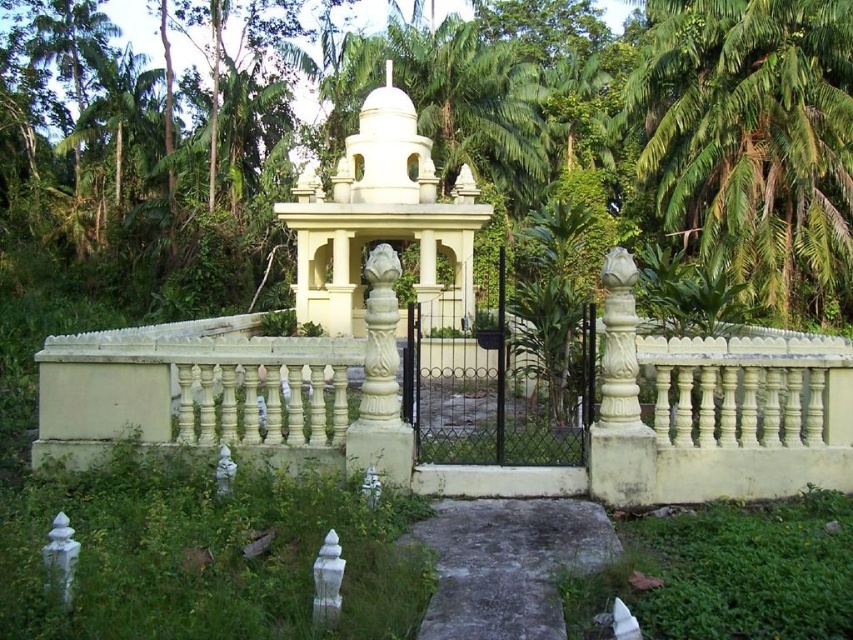
Does green leafy palm tree at upper right have a greater height compared to white stone gazebo at center?

Indeed, green leafy palm tree at upper right has a greater height compared to white stone gazebo at center.

Who is shorter, green leafy palm tree at upper right or white stone gazebo at center?

With less height is white stone gazebo at center.

Find the location of a particular element. This screenshot has height=640, width=853. green leafy palm tree at upper right is located at coordinates (751, 134).

Between white stone fence at center and white stone gazebo at center, which one appears on the right side from the viewer's perspective?

white stone gazebo at center is more to the right.

Is white stone fence at center further to the viewer compared to white stone gazebo at center?

No, it is in front of white stone gazebo at center.

The height and width of the screenshot is (640, 853). What do you see at coordinates (468, 465) in the screenshot?
I see `white stone fence at center` at bounding box center [468, 465].

Where is `white stone fence at center`? This screenshot has width=853, height=640. white stone fence at center is located at coordinates (468, 465).

Does point (287, 378) lie in front of point (828, 77)?

That is True.

The height and width of the screenshot is (640, 853). What do you see at coordinates (468, 465) in the screenshot?
I see `white stone fence at center` at bounding box center [468, 465].

Is point (772, 426) positioned after point (734, 257)?

That is False.

The height and width of the screenshot is (640, 853). In order to click on white stone fence at center in this screenshot , I will do `click(468, 465)`.